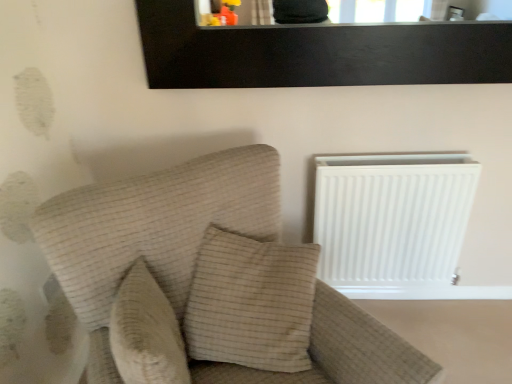
Question: In terms of height, does beige textured pillow at center, which is the first pillow in right-to-left order, look taller or shorter compared to beige textured pillow at center, positioned as the second pillow in right-to-left order?

Choices:
 (A) tall
 (B) short

Answer: (B)

Question: In the image, is beige textured pillow at center, which is counted as the second pillow, starting from the left, positioned in front of or behind beige textured pillow at center, positioned as the second pillow in right-to-left order?

Choices:
 (A) behind
 (B) front

Answer: (A)

Question: Which is farther from the beige textured pillow at center, which is the first pillow in right-to-left order?

Choices:
 (A) beige fabric couch at left
 (B) white matte radiator at right
 (C) black wood picture frame at upper center
 (D) beige textured pillow at center, positioned as the 1th pillow in left-to-right order

Answer: (C)

Question: Which is nearer to the beige fabric couch at left?

Choices:
 (A) white matte radiator at right
 (B) beige textured pillow at center, positioned as the second pillow in right-to-left order
 (C) beige textured pillow at center, which is counted as the second pillow, starting from the left
 (D) black wood picture frame at upper center

Answer: (C)